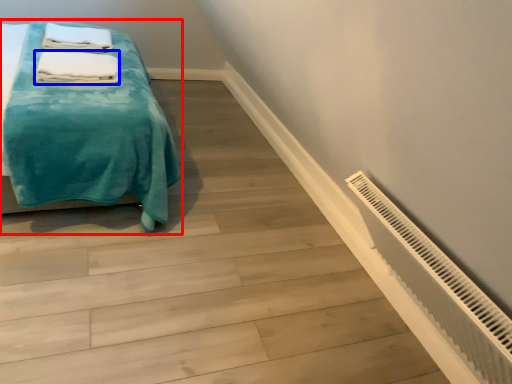
Question: Which point is further to the camera, bed (highlighted by a red box) or bath towel (highlighted by a blue box)?

Choices:
 (A) bed
 (B) bath towel

Answer: (B)